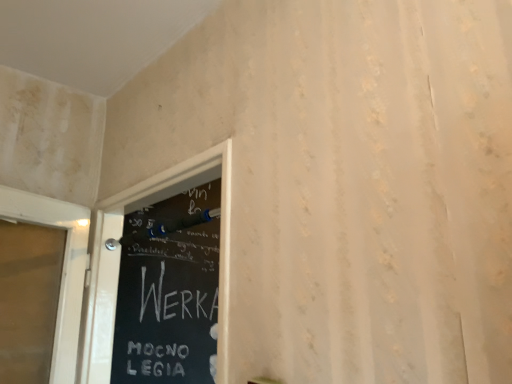
Measure the distance between point (174, 205) and camera.

The depth of point (174, 205) is 2.22 meters.

Describe the element at coordinates (168, 290) in the screenshot. I see `black chalkboard at left` at that location.

Locate an element on the screen. The width and height of the screenshot is (512, 384). black chalkboard at left is located at coordinates (168, 290).

Find the location of a particular element. black chalkboard at left is located at coordinates (168, 290).